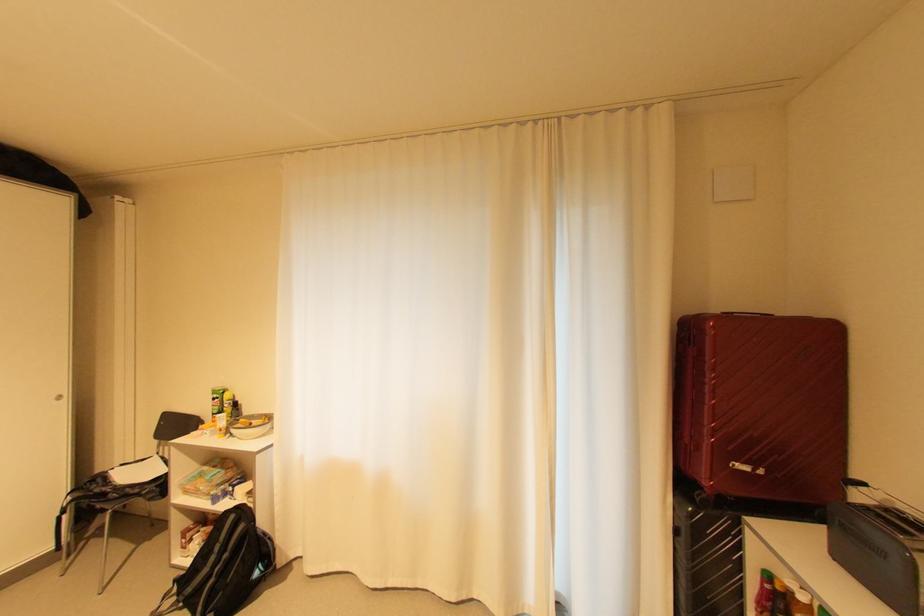
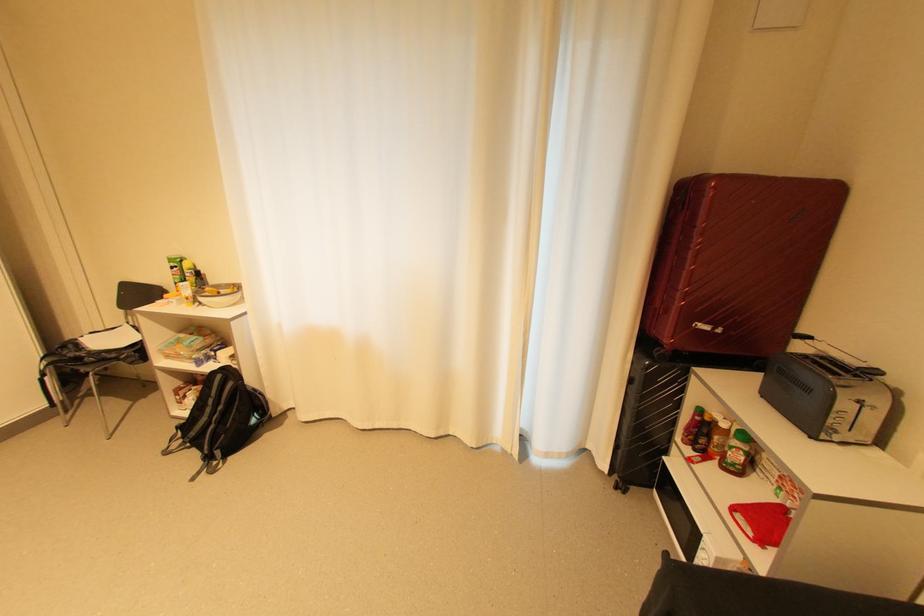
Where in the second image is the point corresponding to (239,517) from the first image?

(226, 377)